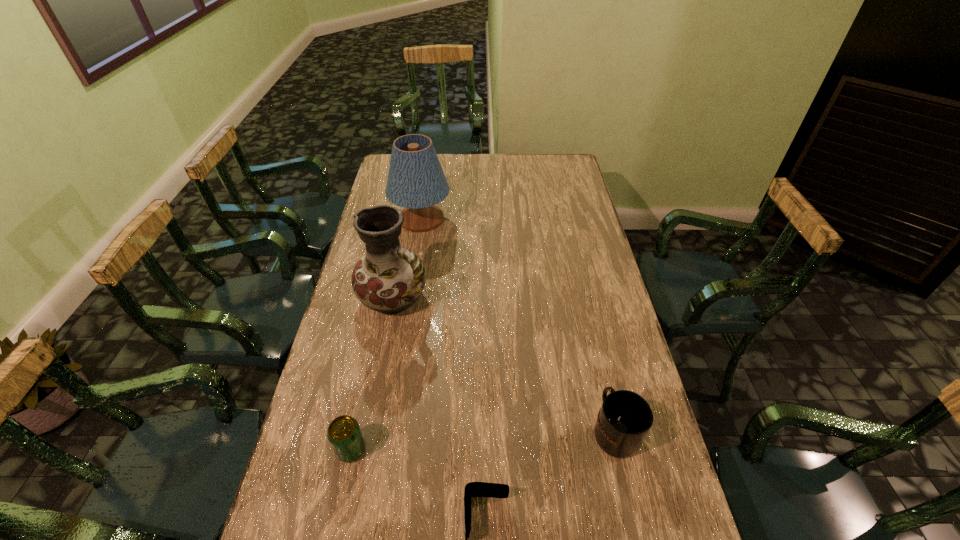
Where is `lampshade at the left edge`? lampshade at the left edge is located at coordinates (416, 181).

The height and width of the screenshot is (540, 960). I want to click on vase at the left edge, so click(x=389, y=279).

Locate an element on the screen. beer can that is at the left edge is located at coordinates (344, 434).

This screenshot has height=540, width=960. I want to click on object that is at the right edge, so click(x=625, y=418).

In order to click on blank space at the far edge of the desktop in this screenshot , I will do `click(478, 178)`.

You are a GUI agent. You are given a task and a screenshot of the screen. Output one action in this format:
    pyautogui.click(x=<x>, y=<y>)
    Task: Click on the vacant area at the left edge
    
    Given the screenshot: What is the action you would take?
    pyautogui.click(x=381, y=180)

I want to click on vacant space at the right edge of the desktop, so click(x=567, y=287).

Identify the location of free space at the far right corner of the desktop. (547, 175).

The image size is (960, 540). In order to click on empty space between the rightmost object and the second farthest object in this screenshot , I will do `click(505, 364)`.

Where is `free area in between the lampshade and the mug`? free area in between the lampshade and the mug is located at coordinates (517, 325).